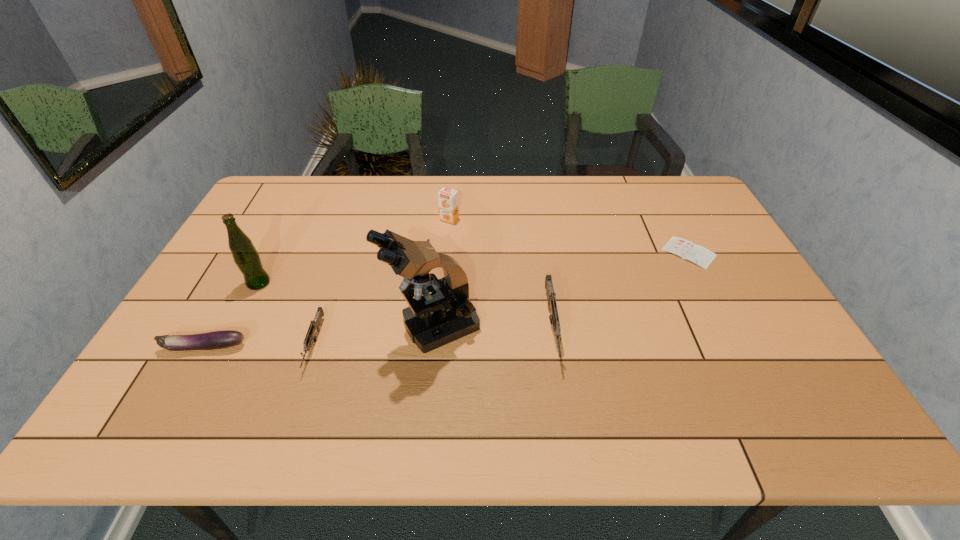
This screenshot has height=540, width=960. In order to click on the shorter gun in this screenshot , I will do `click(315, 324)`.

Locate an element on the screen. The image size is (960, 540). the fifth object from right to left is located at coordinates (315, 324).

At what (x,y) coordinates should I click in order to perform the action: click on the taller gun. Please return your answer as a coordinate pair (x, y). Looking at the image, I should click on (551, 298).

The image size is (960, 540). In order to click on the fourth tallest object in this screenshot , I will do `click(551, 298)`.

Identify the location of the farthest object. (447, 199).

The height and width of the screenshot is (540, 960). Find the location of `the third tallest object`. the third tallest object is located at coordinates (447, 199).

Image resolution: width=960 pixels, height=540 pixels. I want to click on the second tallest object, so click(246, 257).

This screenshot has height=540, width=960. What are the coordinates of `the shortest object` in the screenshot? It's located at (686, 249).

Locate an element on the screen. The image size is (960, 540). the sixth nearest object is located at coordinates (686, 249).

Identify the location of microscope. (432, 320).